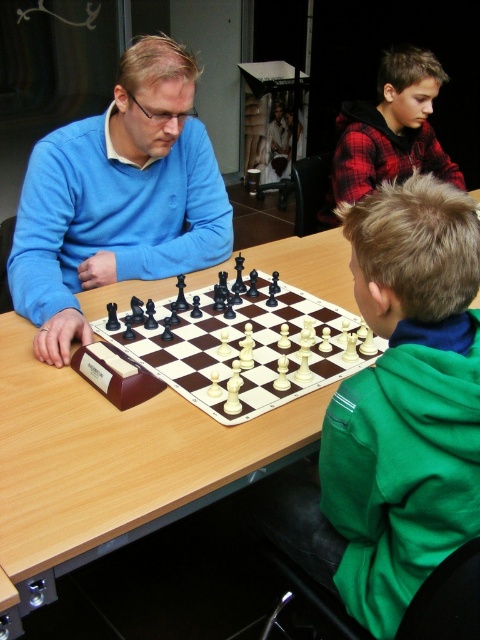
Is wooden table at center shorter than red plaid shirt at upper right?

In fact, wooden table at center may be taller than red plaid shirt at upper right.

Is point (2, 596) more distant than point (433, 147)?

That is False.

Where is `wooden table at center`? This screenshot has height=640, width=480. wooden table at center is located at coordinates (111, 460).

At what (x,y) coordinates should I click in order to perform the action: click on matte plastic chess set at center. Please return your answer as a coordinate pair (x, y). The width and height of the screenshot is (480, 640). Looking at the image, I should click on (242, 346).

Is matte plastic chess set at center further to camera compared to red plaid shirt at upper right?

No, matte plastic chess set at center is closer to the viewer.

You are a GUI agent. You are given a task and a screenshot of the screen. Output one action in this format:
    pyautogui.click(x=<x>, y=<y>)
    Task: Click on the matte plastic chess set at center
    This screenshot has height=640, width=480.
    Given the screenshot: What is the action you would take?
    pyautogui.click(x=242, y=346)

Is green fleece jacket at lower right above wooden table at center?

No.

Is green fleece jacket at lower right positioned behind wooden table at center?

That is False.

Does point (396, 381) lie in front of point (40, 477)?

Yes, it is.

This screenshot has height=640, width=480. What are the coordinates of `green fleece jacket at lower right` in the screenshot? It's located at (396, 410).